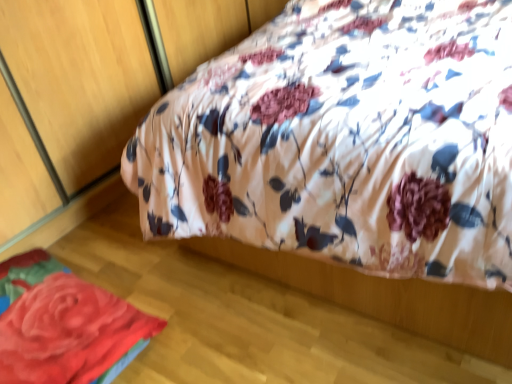
Question: Is fluffy fabric rose at lower left taller or shorter than floral fabric bed at upper center?

Choices:
 (A) tall
 (B) short

Answer: (B)

Question: Is point (37, 322) positioned closer to the camera than point (492, 220)?

Choices:
 (A) farther
 (B) closer

Answer: (A)

Question: From a real-world perspective, is fluffy fabric rose at lower left above or below floral fabric bed at upper center?

Choices:
 (A) above
 (B) below

Answer: (B)

Question: In terms of size, does floral fabric bed at upper center appear bigger or smaller than fluffy fabric rose at lower left?

Choices:
 (A) big
 (B) small

Answer: (A)

Question: From their relative heights in the image, would you say floral fabric bed at upper center is taller or shorter than fluffy fabric rose at lower left?

Choices:
 (A) short
 (B) tall

Answer: (B)

Question: Is floral fabric bed at upper center to the left or to the right of fluffy fabric rose at lower left in the image?

Choices:
 (A) left
 (B) right

Answer: (B)

Question: From a real-world perspective, is floral fabric bed at upper center physically located above or below fluffy fabric rose at lower left?

Choices:
 (A) above
 (B) below

Answer: (A)